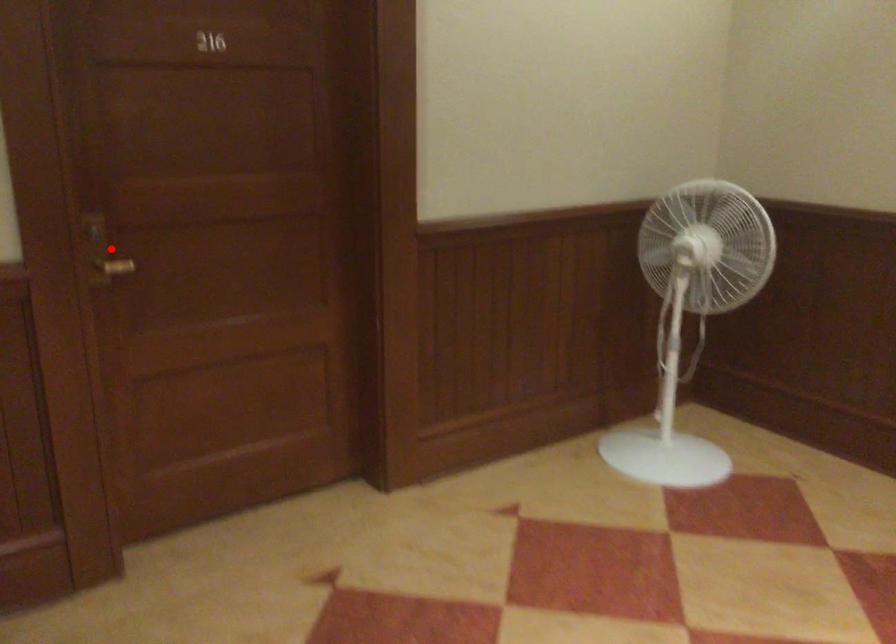
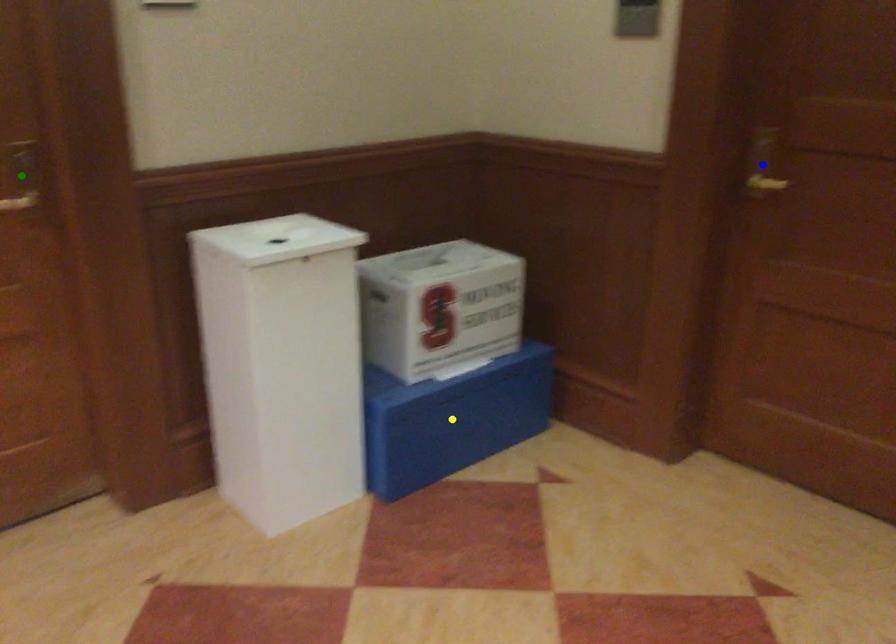
Question: I am providing you with two images of the same scene from different viewpoints. A red point is marked on the first image. You are given multiple points on the second image. Which point in image 2 is actually the same real-world point as the red point in image 1?

Choices:
 (A) green point
 (B) blue point
 (C) yellow point

Answer: (B)